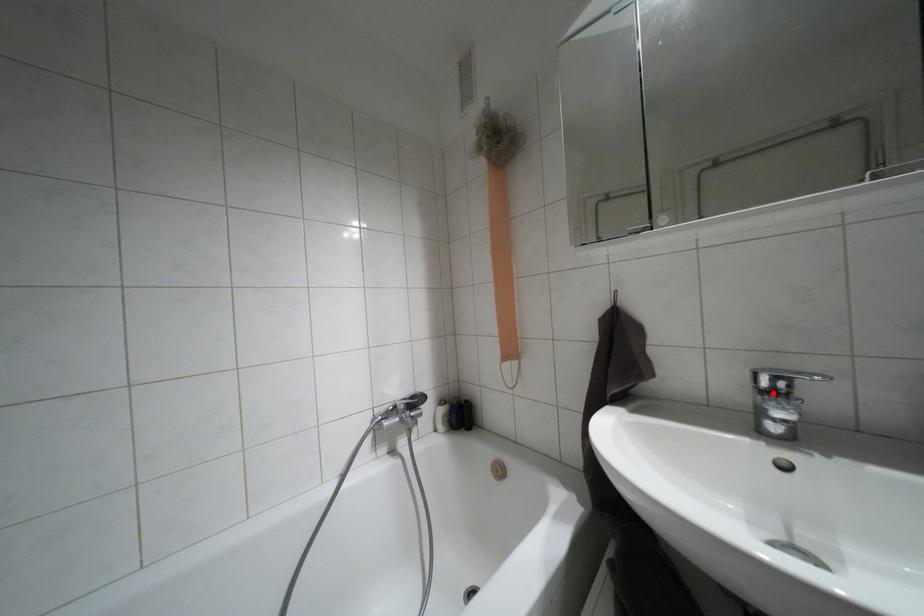
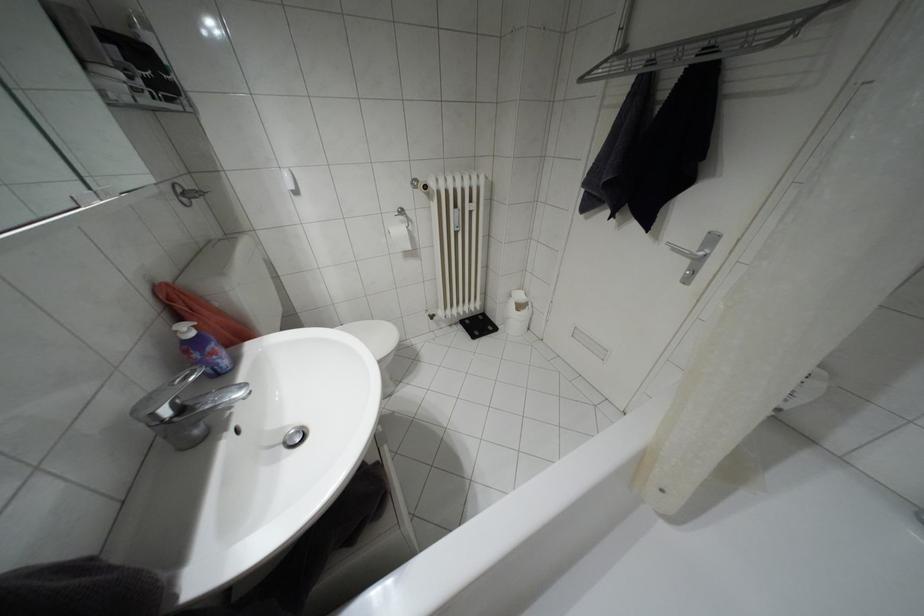
Question: I am providing you with two images of the same scene from different viewpoints. A red point is marked on the first image. Is the red point's position out of view in image 2?

Choices:
 (A) Yes
 (B) No

Answer: (B)